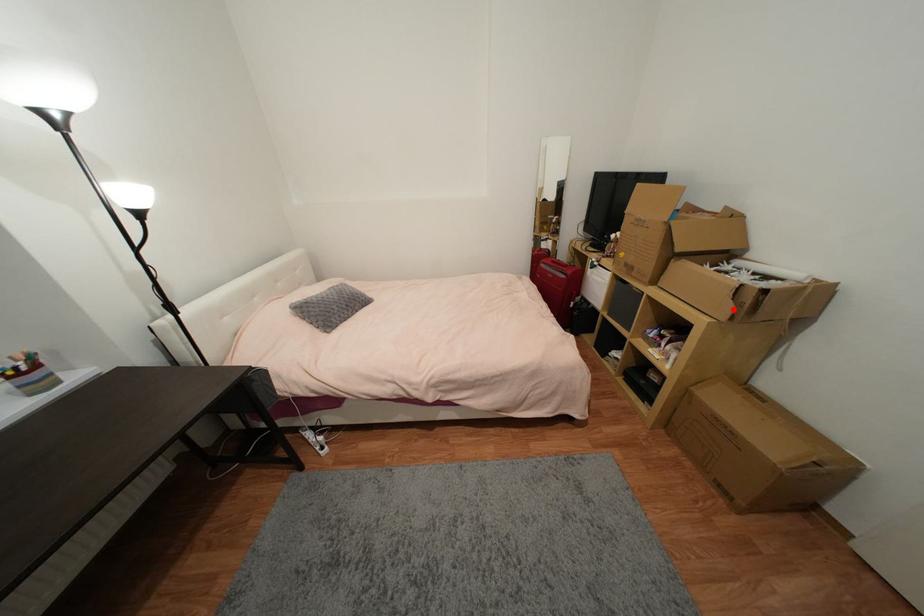
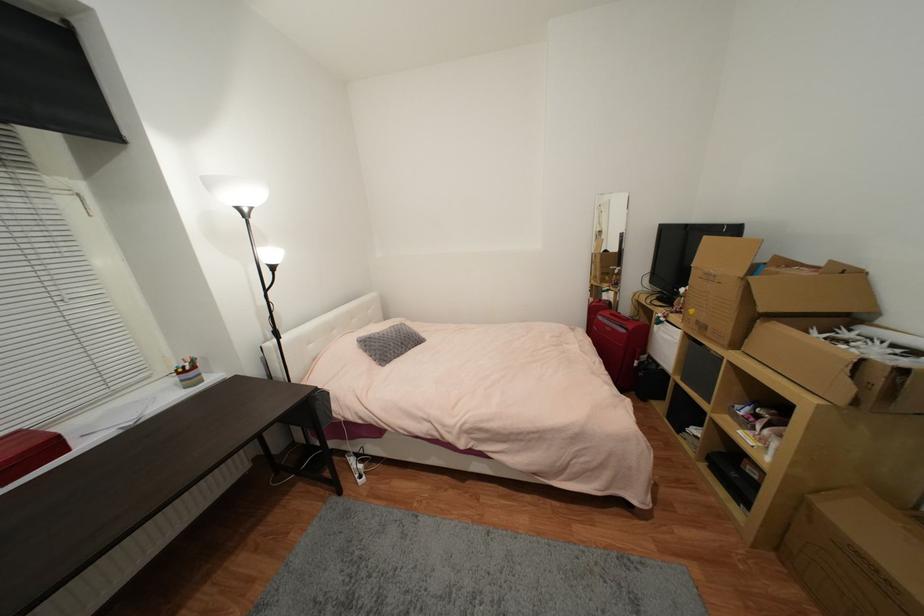
The point at the highlighted location is marked in the first image. Where is the corresponding point in the second image?

(852, 390)